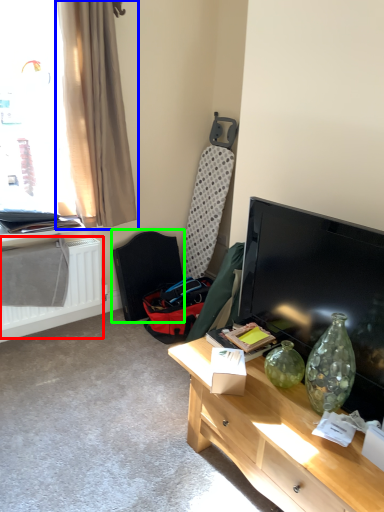
Question: Which is nearer to the radiator (highlighted by a red box)? curtain (highlighted by a blue box) or swivel chair (highlighted by a green box).

Choices:
 (A) curtain
 (B) swivel chair

Answer: (B)